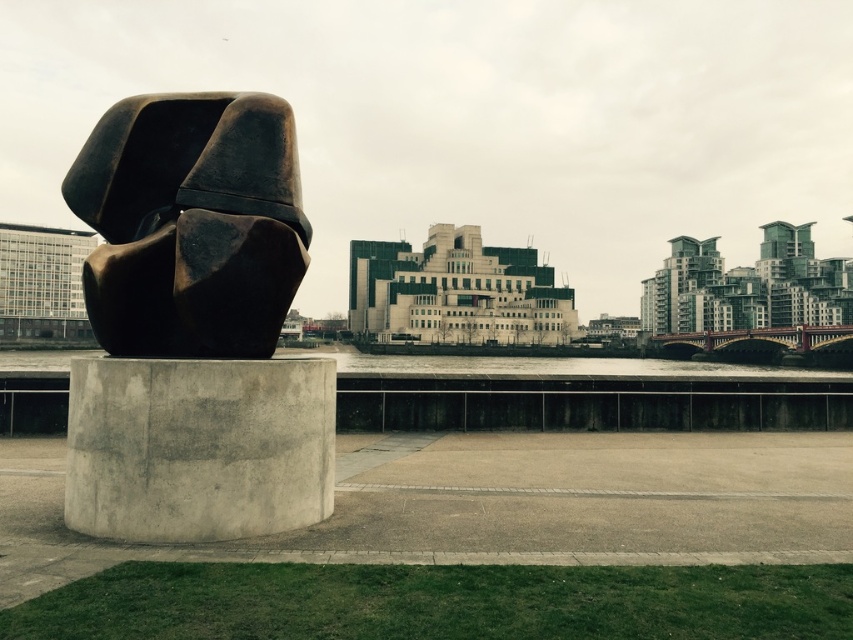
You are an urban planner reviewing this area. You need to place a new bench between the bronze sculpture at left and the gray concrete at center. Based on their positions, which object should the bench be closer to?

The bench should be placed closer to the gray concrete at center since the bronze sculpture at left is positioned to the left of the gray concrete at center, meaning the gray concrete is to the right of the sculpture. Therefore, the midpoint between them would be closer to the gray concrete.

You are standing in front of the bronze sculpture at left in the urban landscape. If you want to take a photo of it from a distance where you can capture the entire sculpture in the frame without moving closer, would you need to use a wide angle lens or a telephoto lens?

Since the bronze sculpture at left is 31.14 feet away from the viewer, a wide angle lens would be necessary to capture the entire sculpture in the frame without moving closer.